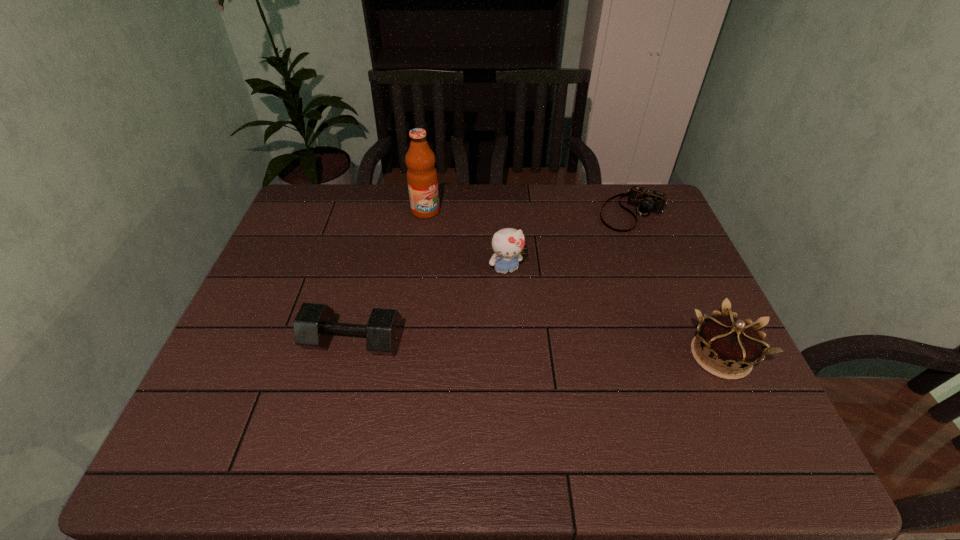
Locate an element on the screen. free spot between the third object from right to left and the dumbbell is located at coordinates (430, 306).

What are the coordinates of `free space between the crown and the fruit juice` in the screenshot? It's located at (573, 284).

At what (x,y) coordinates should I click in order to perform the action: click on free space that is in between the crown and the camera. Please return your answer as a coordinate pair (x, y). This screenshot has height=540, width=960. Looking at the image, I should click on (677, 284).

This screenshot has width=960, height=540. In order to click on vacant area that lies between the kitten and the crown in this screenshot , I will do `click(613, 313)`.

The image size is (960, 540). Identify the location of vacant space that's between the second shortest object and the crown. 538,349.

At what (x,y) coordinates should I click in order to perform the action: click on free spot between the dumbbell and the third object from right to left. Please return your answer as a coordinate pair (x, y). Image resolution: width=960 pixels, height=540 pixels. Looking at the image, I should click on (430, 306).

Locate an element on the screen. This screenshot has width=960, height=540. unoccupied area between the third nearest object and the dumbbell is located at coordinates (430, 306).

You are a GUI agent. You are given a task and a screenshot of the screen. Output one action in this format:
    pyautogui.click(x=<x>, y=<y>)
    Task: Click on the blank region between the tallest object and the kitten
    The height and width of the screenshot is (540, 960).
    Given the screenshot: What is the action you would take?
    pyautogui.click(x=466, y=240)

Where is `vacant space that is in between the dumbbell and the third shortest object`? This screenshot has height=540, width=960. vacant space that is in between the dumbbell and the third shortest object is located at coordinates (538, 349).

Identify which object is the fourth closest to the tallest object. Please provide its 2D coordinates. Your answer should be formatted as a tuple, i.e. [(x, y)], where the tuple contains the x and y coordinates of a point satisfying the conditions above.

[(726, 341)]